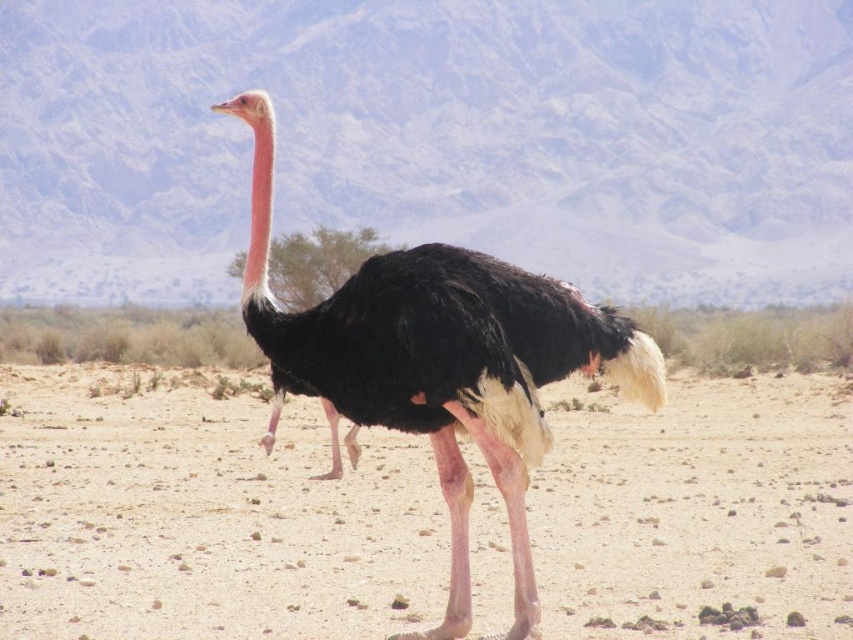
Question: Estimate the real-world distances between objects in this image. Which object is farther from the white matte head at center?

Choices:
 (A) brown sandy dirt at center
 (B) black feathered ostrich at center

Answer: (A)

Question: Based on their relative distances, which object is farther from the brown sandy dirt at center?

Choices:
 (A) white matte head at center
 (B) black feathered ostrich at center

Answer: (A)

Question: Is black feathered ostrich at center in front of white matte head at center?

Choices:
 (A) yes
 (B) no

Answer: (A)

Question: From the image, what is the correct spatial relationship of brown sandy dirt at center in relation to white matte head at center?

Choices:
 (A) left
 (B) right

Answer: (B)

Question: Does brown sandy dirt at center have a greater width compared to white matte head at center?

Choices:
 (A) yes
 (B) no

Answer: (A)

Question: Which of the following is the closest to the observer?

Choices:
 (A) (3, 390)
 (B) (462, 305)

Answer: (B)